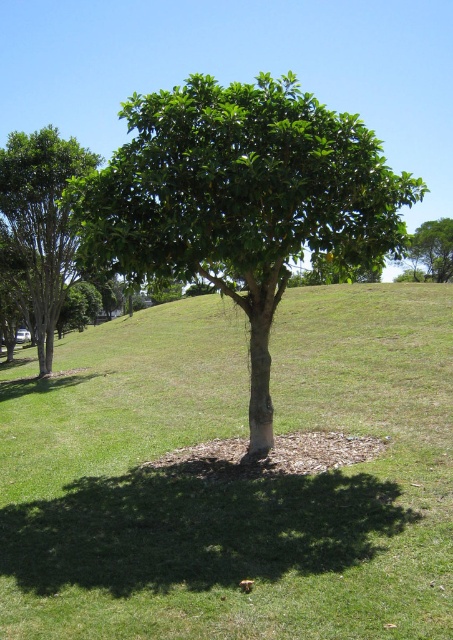
What do you see at coordinates (235, 480) in the screenshot? This screenshot has height=640, width=453. I see `green grass at center` at bounding box center [235, 480].

Who is positioned more to the right, green grass at center or green leafy tree at upper center?

green leafy tree at upper center

Does point (231, 344) come farther from viewer compared to point (432, 225)?

No, (231, 344) is in front of (432, 225).

Where is `green grass at center`? green grass at center is located at coordinates (235, 480).

Is point (138, 147) more distant than point (423, 262)?

No, it is not.

Between green leafy tree at center and green leafy tree at upper center, which one has more height?

Standing taller between the two is green leafy tree at center.

Is point (250, 433) positioned behind point (437, 262)?

No, it is not.

The image size is (453, 640). Find the location of `green leafy tree at center`. green leafy tree at center is located at coordinates (241, 198).

Does point (283, 608) come closer to viewer compared to point (4, 166)?

That is True.

Does green grass at center have a smaller size compared to green leafy tree at left?

Correct, green grass at center occupies less space than green leafy tree at left.

What are the coordinates of `green grass at center` in the screenshot? It's located at (235, 480).

You are a GUI agent. You are given a task and a screenshot of the screen. Output one action in this format:
    pyautogui.click(x=<x>, y=<y>)
    Task: Click on the green grass at center
    The height and width of the screenshot is (640, 453).
    Given the screenshot: What is the action you would take?
    pyautogui.click(x=235, y=480)